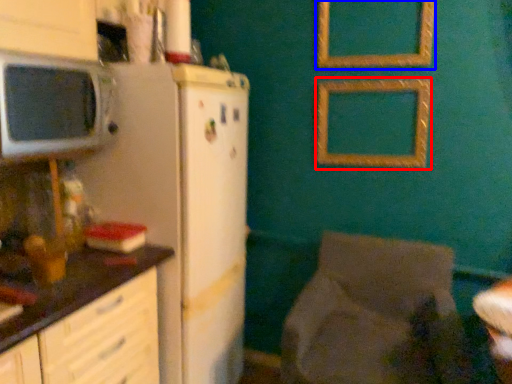
Question: Among these objects, which one is nearest to the camera, picture frame (highlighted by a red box) or picture frame (highlighted by a blue box)?

Choices:
 (A) picture frame
 (B) picture frame

Answer: (B)